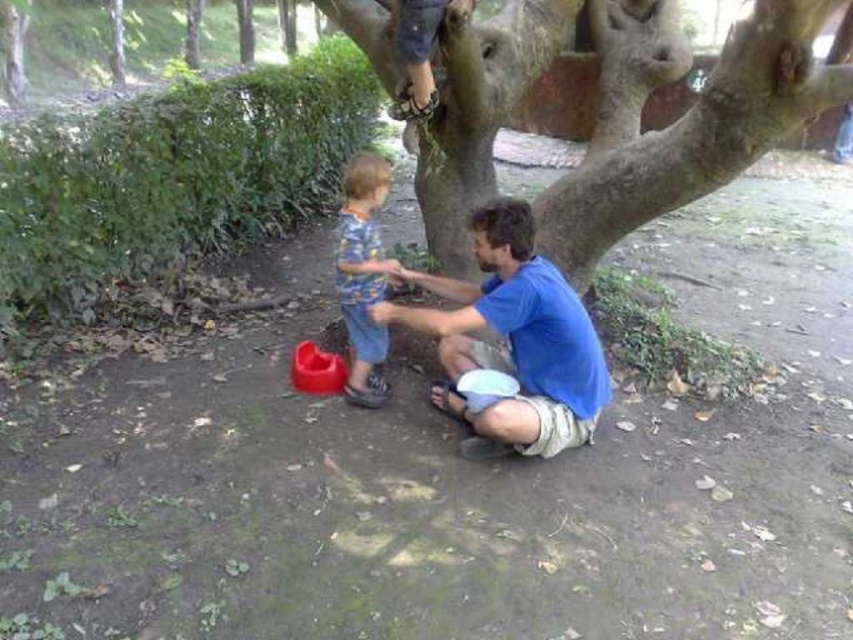
You are standing in the park and see two points marked in the image. Which point is closer to you, point [601,236] or point [358,268]?

Point [601,236] is closer to you because it is further to the viewer than point [358,268].

You are standing in the park and see the rough bark tree at center and the matte blue shirt at center. Which object is located to the right of the other?

The rough bark tree at center is to the right of the matte blue shirt at center.

You are trying to determine if the rough bark tree at center can be wrapped around the matte blue shirt at center. Based on their widths, is this possible?

The rough bark tree at center might be wider than matte blue shirt at center, so it might not be possible to wrap the tree around the shirt due to the tree being wider.